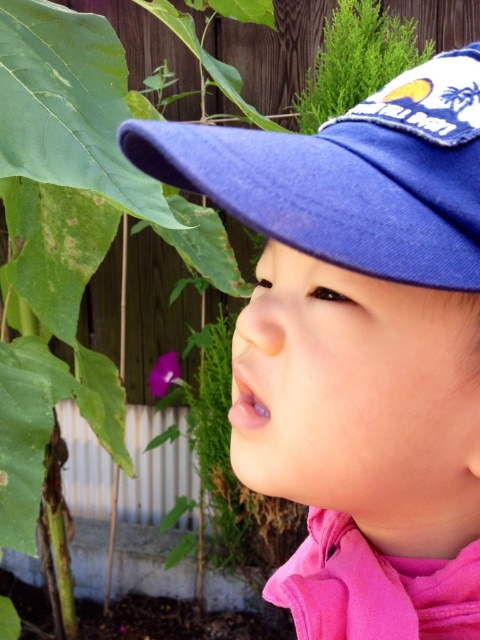
What are the coordinates of the blue fabric cap at upper center in the image?

The blue fabric cap at upper center is located at coordinates point (x=359, y=346).